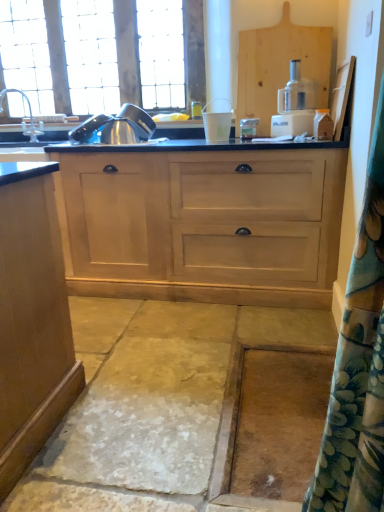
Describe the element at coordinates (117, 127) in the screenshot. I see `stainless steel kettle at upper left, the first appliance from the left` at that location.

Image resolution: width=384 pixels, height=512 pixels. What do you see at coordinates (103, 54) in the screenshot?
I see `clear glass window at upper left` at bounding box center [103, 54].

Describe the element at coordinates (151, 402) in the screenshot. I see `smooth stone concrete at center` at that location.

Identify the location of silver metallic faucet at left. (29, 115).

At what (x,y) coordinates should I click in order to perform the action: click on stainless steel kettle at upper left, which is the second appliance from right to left. Please return your answer as a coordinate pair (x, y). Looking at the image, I should click on (117, 127).

Is wooden cutting board at upper right in front of or behind smooth stone concrete at center in the image?

wooden cutting board at upper right is positioned farther from the viewer than smooth stone concrete at center.

Is wooden cutting board at upper right surrounding smooth stone concrete at center?

No, smooth stone concrete at center is located outside of wooden cutting board at upper right.

Based on the photo, is wooden cutting board at upper right bigger or smaller than smooth stone concrete at center?

wooden cutting board at upper right is smaller than smooth stone concrete at center.

Which of these two, wooden cutting board at upper right or stainless steel kettle at upper left, the first appliance from the left, is wider?

Wider between the two is stainless steel kettle at upper left, the first appliance from the left.

Considering the sizes of wooden cutting board at upper right and stainless steel kettle at upper left, which is the second appliance from right to left, in the image, is wooden cutting board at upper right taller or shorter than stainless steel kettle at upper left, which is the second appliance from right to left,?

wooden cutting board at upper right is taller than stainless steel kettle at upper left, which is the second appliance from right to left.

Consider the image. From a real-world perspective, is wooden cutting board at upper right physically above stainless steel kettle at upper left, which is the second appliance from right to left?

Yes.

What are the coordinates of `cabinetry above the stainless steel kettle at upper left, the first appliance from the left (from the image's perspective)` in the screenshot? It's located at (278, 65).

Who is bigger, white plastic cup at center, acting as the 1th appliance starting from the right, or smooth stone concrete at center?

With larger size is smooth stone concrete at center.

Do you think white plastic cup at center, placed as the second appliance when sorted from left to right, is within smooth stone concrete at center, or outside of it?

white plastic cup at center, placed as the second appliance when sorted from left to right, is spatially situated outside smooth stone concrete at center.

From the image's perspective, is white plastic cup at center, acting as the 1th appliance starting from the right, over smooth stone concrete at center?

Yes, from the image's perspective, white plastic cup at center, acting as the 1th appliance starting from the right, is over smooth stone concrete at center.

Does wooden cutting board at upper right have a greater height compared to white plastic cup at center, placed as the second appliance when sorted from left to right?

Correct, wooden cutting board at upper right is much taller as white plastic cup at center, placed as the second appliance when sorted from left to right.

Considering the positions of point (247, 56) and point (207, 120), is point (247, 56) closer or farther from the camera than point (207, 120)?

Point (247, 56) is positioned closer to the camera compared to point (207, 120).

Considering the relative positions of wooden cutting board at upper right and white plastic cup at center, acting as the 1th appliance starting from the right, in the image provided, is wooden cutting board at upper right to the left or to the right of white plastic cup at center, acting as the 1th appliance starting from the right,?

From the image, it's evident that wooden cutting board at upper right is to the right of white plastic cup at center, acting as the 1th appliance starting from the right.

Between wooden cutting board at upper right and white plastic cup at center, acting as the 1th appliance starting from the right, which one has smaller size?

white plastic cup at center, acting as the 1th appliance starting from the right, is smaller.

Which is more to the left, white plastic food processor at center or smooth stone concrete at center?

smooth stone concrete at center is more to the left.

From the image's perspective, which is below, white plastic food processor at center or smooth stone concrete at center?

smooth stone concrete at center.

Is white plastic food processor at center shorter than smooth stone concrete at center?

Incorrect, the height of white plastic food processor at center does not fall short of that of smooth stone concrete at center.

From a real-world perspective, which is physically above, white plastic food processor at center or smooth stone concrete at center?

From a 3D spatial view, white plastic food processor at center is above.

Consider the image. Is light wood cabinet at center not close to smooth stone concrete at center?

light wood cabinet at center is actually quite close to smooth stone concrete at center.

Is light wood cabinet at center positioned with its back to smooth stone concrete at center?

No, light wood cabinet at center is not facing away from smooth stone concrete at center.

Considering the relative sizes of light wood cabinet at center and smooth stone concrete at center in the image provided, is light wood cabinet at center wider than smooth stone concrete at center?

In fact, light wood cabinet at center might be narrower than smooth stone concrete at center.

From the picture: How many degrees apart are the facing directions of light wood cabinet at center and smooth stone concrete at center?

The facing directions of light wood cabinet at center and smooth stone concrete at center are 0.555 degrees apart.

From the image's perspective, is stainless steel kettle at upper left, which is the second appliance from right to left, below clear glass window at upper left?

Yes.

Would you say stainless steel kettle at upper left, the first appliance from the left, contains clear glass window at upper left?

No, clear glass window at upper left is not surrounded by stainless steel kettle at upper left, the first appliance from the left.

Is stainless steel kettle at upper left, which is the second appliance from right to left, in contact with clear glass window at upper left?

No, stainless steel kettle at upper left, which is the second appliance from right to left, is not next to clear glass window at upper left.

Find the location of `concrete that appears on the left of wooden cutting board at upper right`. concrete that appears on the left of wooden cutting board at upper right is located at coordinates pyautogui.click(x=151, y=402).

At what (x,y) coordinates should I click in order to perform the action: click on the 1st appliance below when counting from the wooden cutting board at upper right (from the image's perspective). Please return your answer as a coordinate pair (x, y). Looking at the image, I should click on (117, 127).

Based on their spatial positions, is light wood cabinet at center or smooth stone concrete at center closer to silver metallic faucet at left?

Based on the image, light wood cabinet at center appears to be nearer to silver metallic faucet at left.

Consider the image. Which object lies nearer to the anchor point white plastic food processor at center, light wood cabinet at center or wooden cutting board at upper right?

The object closer to white plastic food processor at center is wooden cutting board at upper right.

Looking at this image, from the image, which object appears to be nearer to white plastic cup at center, acting as the 1th appliance starting from the right, clear glass window at upper left or smooth stone concrete at center?

clear glass window at upper left lies closer to white plastic cup at center, acting as the 1th appliance starting from the right, than the other object.

When comparing their distances from smooth stone concrete at center, does silver metallic faucet at left or white plastic food processor at center seem further?

Among the two, silver metallic faucet at left is located further to smooth stone concrete at center.

From the image, which object appears to be farther from clear glass window at upper left, wooden cutting board at upper right or light wood cabinet at center?

light wood cabinet at center.

Based on their spatial positions, is light wood cabinet at center or clear glass window at upper left closer to wooden cutting board at upper right?

light wood cabinet at center.

When comparing their distances from silver metallic faucet at left, does smooth stone concrete at center or clear glass window at upper left seem further?

The object further to silver metallic faucet at left is smooth stone concrete at center.

Based on their spatial positions, is white plastic food processor at center or white plastic cup at center, acting as the 1th appliance starting from the right, closer to smooth stone concrete at center?

white plastic food processor at center lies closer to smooth stone concrete at center than the other object.

You are a GUI agent. You are given a task and a screenshot of the screen. Output one action in this format:
    pyautogui.click(x=<x>, y=<y>)
    Task: Click on the cupboard between silver metallic faucet at left and wooden cutting board at upper right in the horizontal direction
    This screenshot has height=512, width=384.
    Given the screenshot: What is the action you would take?
    pyautogui.click(x=203, y=221)

Image resolution: width=384 pixels, height=512 pixels. Identify the location of cupboard between silver metallic faucet at left and white plastic food processor at center from left to right. (203, 221).

Locate an element on the screen. This screenshot has width=384, height=512. cabinetry between silver metallic faucet at left and white plastic food processor at center is located at coordinates (278, 65).

Identify the location of cupboard situated between clear glass window at upper left and wooden cutting board at upper right from left to right. (203, 221).